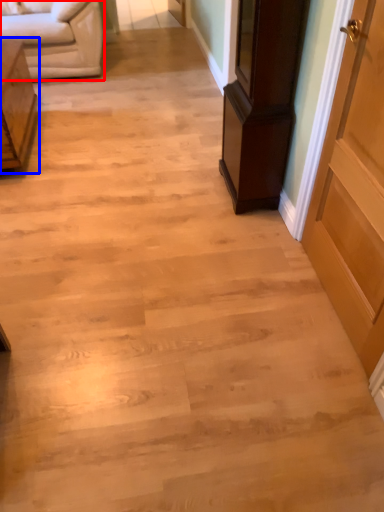
Question: Among these objects, which one is farthest to the camera, studio couch (highlighted by a red box) or furniture (highlighted by a blue box)?

Choices:
 (A) studio couch
 (B) furniture

Answer: (A)